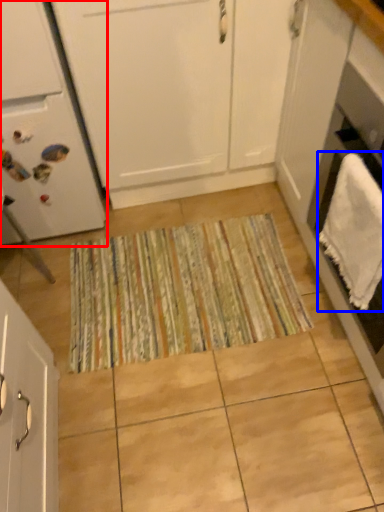
Question: Which object is further to the camera taking this photo, home appliance (highlighted by a red box) or bath towel (highlighted by a blue box)?

Choices:
 (A) home appliance
 (B) bath towel

Answer: (A)